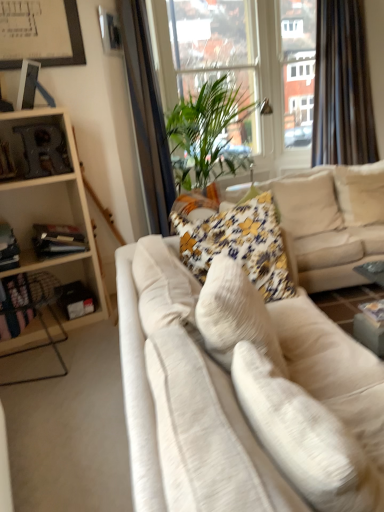
Question: Should I look upward or downward to see velvet beige couch at center, the second studio couch when ordered from front to back?

Choices:
 (A) down
 (B) up

Answer: (B)

Question: Does transparent glass window screen at upper center have a greater height compared to white fabric couch at center, placed as the second studio couch when sorted from back to front?

Choices:
 (A) yes
 (B) no

Answer: (A)

Question: Is transparent glass window screen at upper center located outside white fabric couch at center, the first studio couch viewed from the front?

Choices:
 (A) no
 (B) yes

Answer: (B)

Question: Can you confirm if transparent glass window screen at upper center is positioned to the right of white fabric couch at center, the first studio couch viewed from the front?

Choices:
 (A) yes
 (B) no

Answer: (B)

Question: From the image's perspective, would you say transparent glass window screen at upper center is shown under white fabric couch at center, placed as the second studio couch when sorted from back to front?

Choices:
 (A) yes
 (B) no

Answer: (B)

Question: Considering the relative positions of transparent glass window screen at upper center and white fabric couch at center, placed as the second studio couch when sorted from back to front, in the image provided, is transparent glass window screen at upper center to the left of white fabric couch at center, placed as the second studio couch when sorted from back to front, from the viewer's perspective?

Choices:
 (A) yes
 (B) no

Answer: (A)

Question: Considering the relative sizes of transparent glass window screen at upper center and white fabric couch at center, the first studio couch viewed from the front, in the image provided, is transparent glass window screen at upper center wider than white fabric couch at center, the first studio couch viewed from the front,?

Choices:
 (A) no
 (B) yes

Answer: (A)

Question: Can you confirm if white fabric pillow at center, which appears as the first pillow when viewed from the front, is thinner than velvet beige couch at center, the second studio couch when ordered from front to back?

Choices:
 (A) no
 (B) yes

Answer: (B)

Question: Does white fabric pillow at center, which appears as the first pillow when viewed from the front, appear on the left side of velvet beige couch at center, the second studio couch when ordered from front to back?

Choices:
 (A) yes
 (B) no

Answer: (A)

Question: From a real-world perspective, does white fabric pillow at center, arranged as the 4th pillow when viewed from the back, sit lower than velvet beige couch at center, the second studio couch when ordered from front to back?

Choices:
 (A) no
 (B) yes

Answer: (A)

Question: Does white fabric pillow at center, which appears as the first pillow when viewed from the front, turn towards velvet beige couch at center, the second studio couch when ordered from front to back?

Choices:
 (A) no
 (B) yes

Answer: (A)

Question: Does white fabric pillow at center, arranged as the 4th pillow when viewed from the back, have a lesser height compared to velvet beige couch at center, the second studio couch when ordered from front to back?

Choices:
 (A) no
 (B) yes

Answer: (B)

Question: Does white fabric pillow at center, which appears as the first pillow when viewed from the front, lie in front of velvet beige couch at center, arranged as the first studio couch when viewed from the back?

Choices:
 (A) no
 (B) yes

Answer: (B)

Question: Does transparent glass window screen at upper center come in front of wooden bookshelf at left?

Choices:
 (A) yes
 (B) no

Answer: (B)